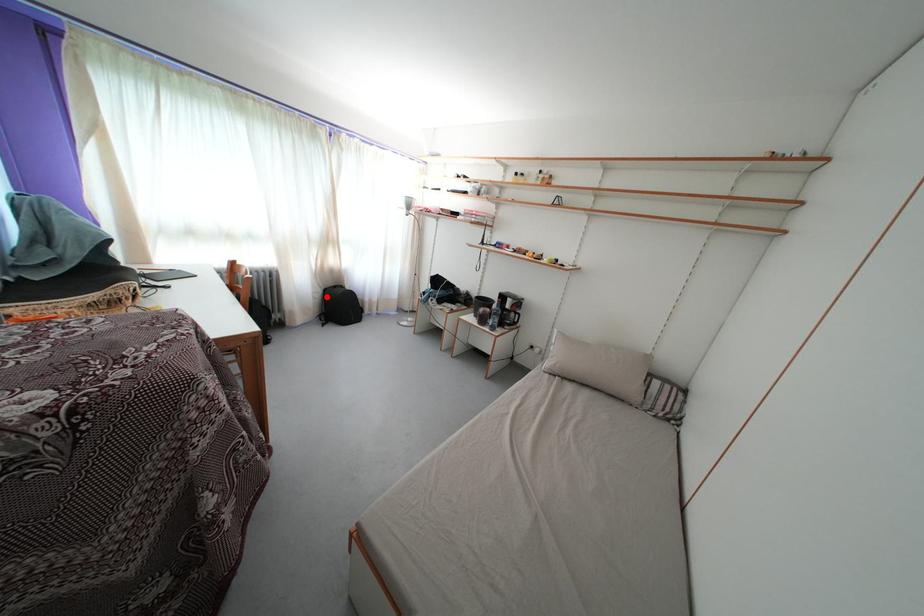
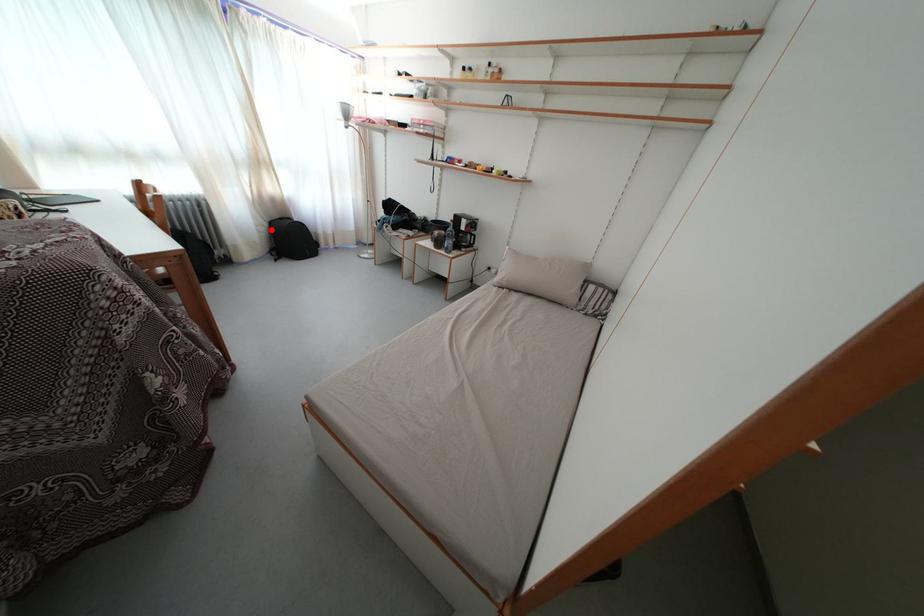
I am providing you with two images of the same scene from different viewpoints. A red point is marked on the first image and another point is marked on the second image. Does the point marked in image1 correspond to the same location as the one in image2?

Yes